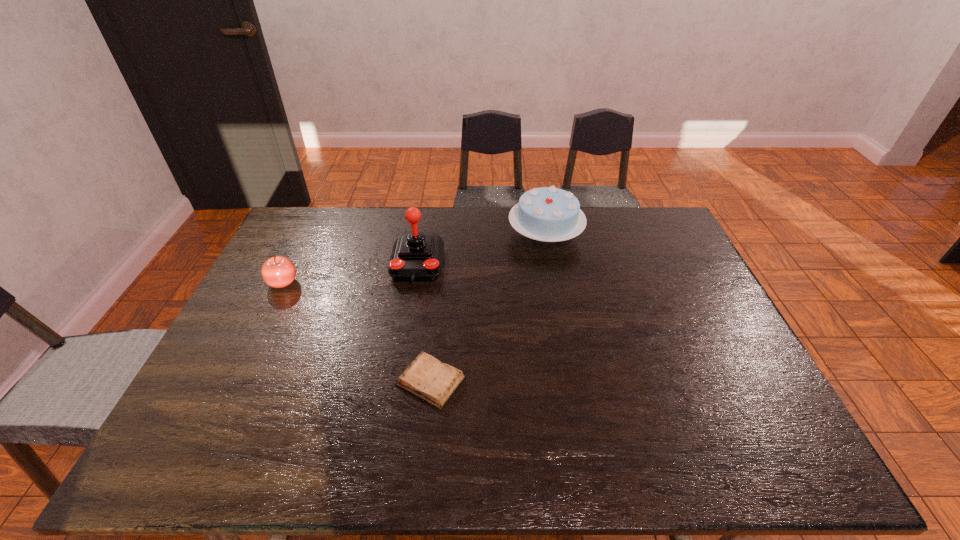
I want to click on joystick, so click(x=417, y=256).

Find the location of a particular element. This screenshot has width=960, height=540. the rightmost object is located at coordinates (549, 214).

Where is `birthday cake`? This screenshot has width=960, height=540. birthday cake is located at coordinates (549, 214).

The image size is (960, 540). What are the coordinates of `the third tallest object` in the screenshot? It's located at (x=278, y=271).

Identify the location of the leftmost object. (278, 271).

The image size is (960, 540). In order to click on the nearest object in this screenshot , I will do `click(426, 377)`.

Identify the location of diary. (426, 377).

The image size is (960, 540). What are the coordinates of `blank space located on the base of the joystick` in the screenshot? It's located at point(411,303).

The width and height of the screenshot is (960, 540). I want to click on vacant area situated 0.160m on the left of the rightmost object, so click(x=464, y=234).

What are the coordinates of `free location located 0.270m on the back of the second shortest object` in the screenshot? It's located at (312, 224).